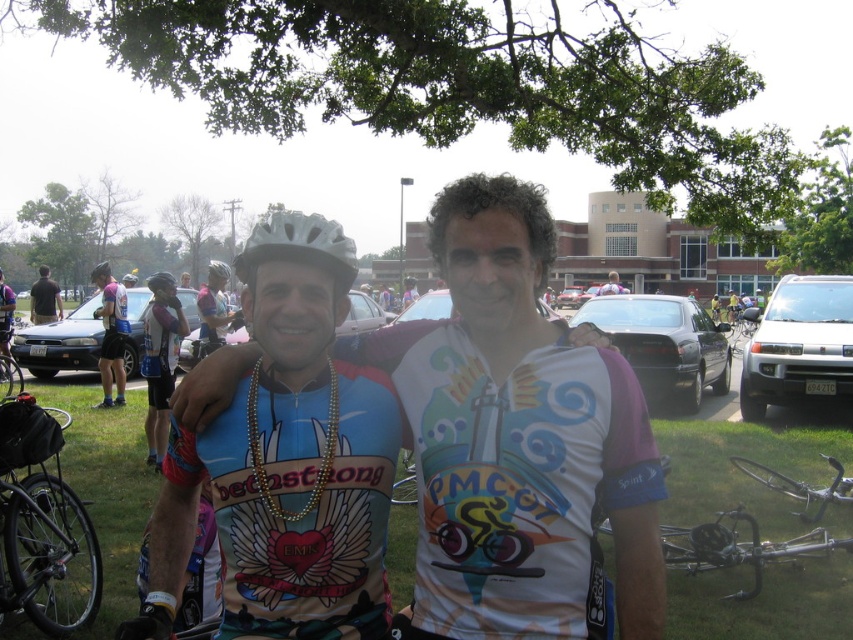
Question: Which point is closer to the camera?

Choices:
 (A) pyautogui.click(x=160, y=284)
 (B) pyautogui.click(x=45, y=269)
 (C) pyautogui.click(x=618, y=276)
 (D) pyautogui.click(x=666, y=458)

Answer: (D)

Question: Can you confirm if matte black cycling jersey at left is positioned to the right of white matte bicycle helmet at center?

Choices:
 (A) no
 (B) yes

Answer: (B)

Question: Does dark blue shirt at left have a smaller size compared to white helmet at center?

Choices:
 (A) no
 (B) yes

Answer: (B)

Question: Where is black matte bicycle at lower left located in relation to white matte bicycle helmet at center in the image?

Choices:
 (A) above
 (B) below

Answer: (B)

Question: Which point is farther to the camera?

Choices:
 (A) (688, 532)
 (B) (216, 310)
 (C) (45, 544)

Answer: (B)

Question: Considering the real-world distances, which object is farthest from the black matte bicycle at lower left?

Choices:
 (A) silver metallic bicycle at lower right
 (B) white matte bicycle helmet at upper center

Answer: (A)